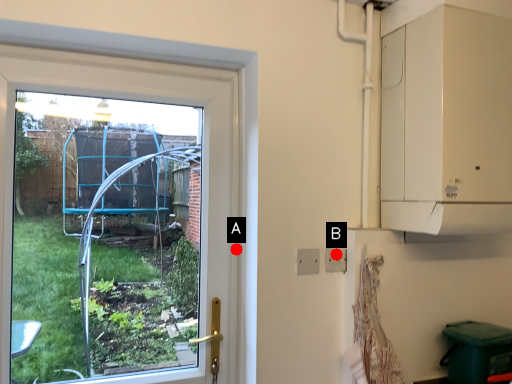
Question: Two points are circled on the image, labeled by A and B beside each circle. Which point appears closest to the camera in this image?

Choices:
 (A) A is closer
 (B) B is closer

Answer: (B)